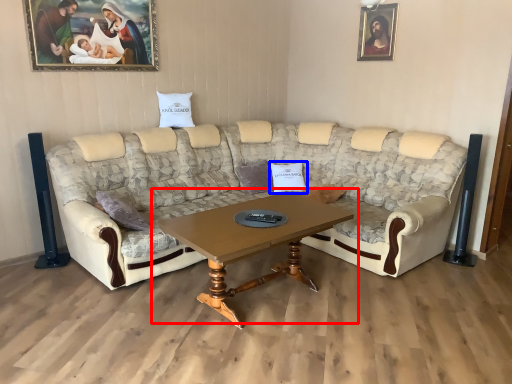
Question: Among these objects, which one is farthest to the camera, coffee table (highlighted by a red box) or pillow (highlighted by a blue box)?

Choices:
 (A) coffee table
 (B) pillow

Answer: (B)